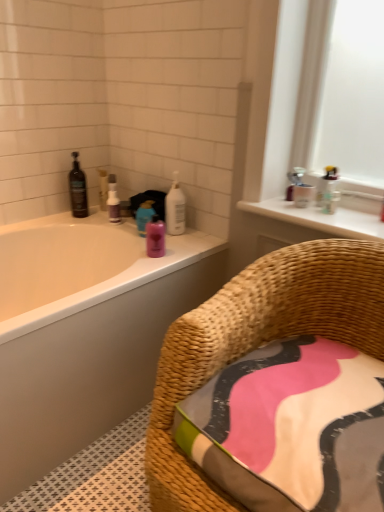
Locate an element on the screen. This screenshot has width=384, height=512. free space behind purple matte spray bottle at upper left, the second cleaning product positioned from the right is located at coordinates (110, 214).